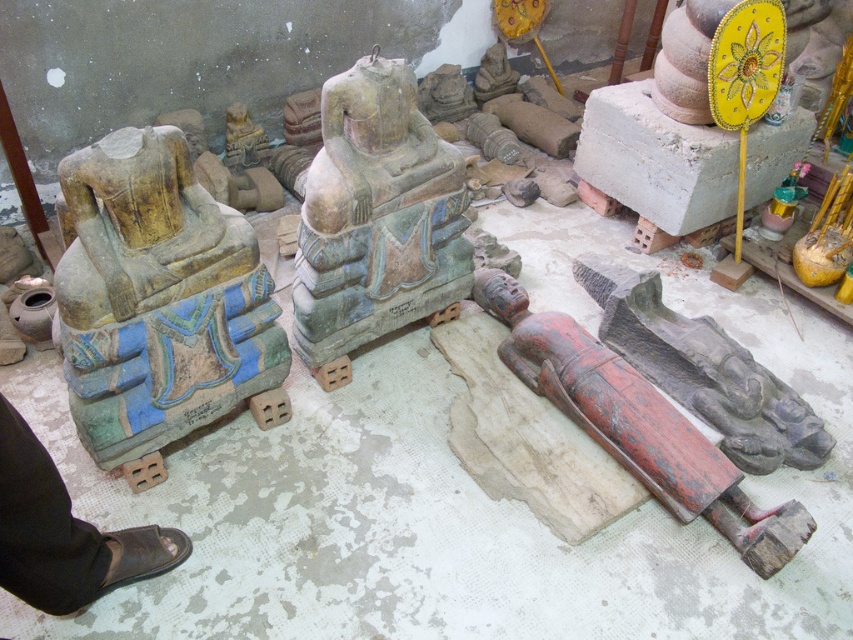
Can you confirm if green stone statue at center is taller than red painted wood figure at lower right?

Yes, green stone statue at center is taller than red painted wood figure at lower right.

Between green stone statue at center and red painted wood figure at lower right, which one is positioned higher?

green stone statue at center is above.

This screenshot has width=853, height=640. Describe the element at coordinates (375, 220) in the screenshot. I see `green stone statue at center` at that location.

Locate an element on the screen. This screenshot has width=853, height=640. green stone statue at center is located at coordinates (375, 220).

Is yellowish stone statue at left smaller than green stone statue at center?

Indeed, yellowish stone statue at left has a smaller size compared to green stone statue at center.

Between point (225, 326) and point (328, 211), which one is positioned behind?

The point (328, 211) is behind.

Is point (76, 372) positioned in front of point (312, 304)?

Yes, point (76, 372) is in front of point (312, 304).

Locate an element on the screen. yellowish stone statue at left is located at coordinates click(160, 301).

Can you confirm if yellowish stone statue at left is thinner than red painted wood figure at lower right?

Correct, yellowish stone statue at left's width is less than red painted wood figure at lower right's.

Image resolution: width=853 pixels, height=640 pixels. In order to click on yellowish stone statue at left in this screenshot , I will do `click(160, 301)`.

You are a GUI agent. You are given a task and a screenshot of the screen. Output one action in this format:
    pyautogui.click(x=<x>, y=<y>)
    Task: Click on the yellowish stone statue at left
    This screenshot has height=640, width=853.
    Given the screenshot: What is the action you would take?
    pyautogui.click(x=160, y=301)